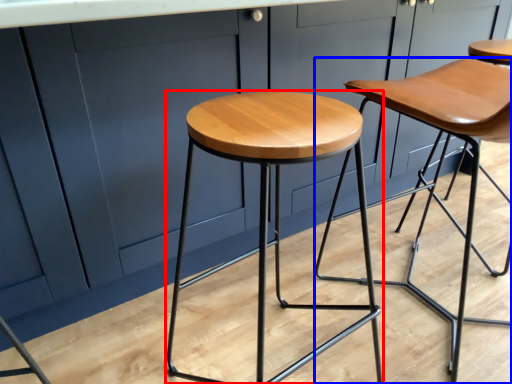
Question: Among these objects, which one is nearest to the camera, stool (highlighted by a red box) or stool (highlighted by a blue box)?

Choices:
 (A) stool
 (B) stool

Answer: (A)